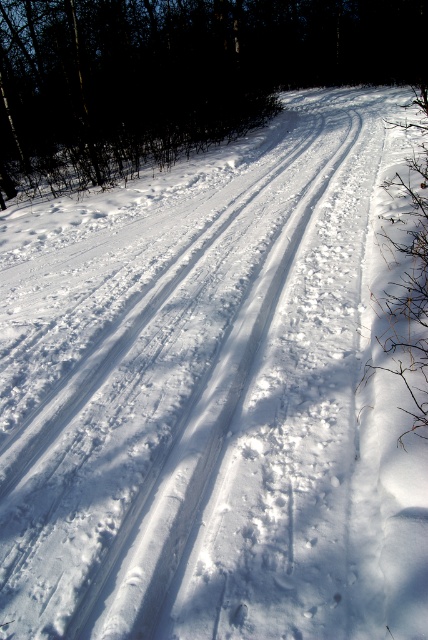
Question: Is brown wood tree at upper left positioned behind brown textured branch at right?

Choices:
 (A) no
 (B) yes

Answer: (B)

Question: Is brown wood tree at upper left to the left of brown textured branch at right from the viewer's perspective?

Choices:
 (A) yes
 (B) no

Answer: (A)

Question: Is brown wood tree at upper left to the left of brown textured branch at right from the viewer's perspective?

Choices:
 (A) no
 (B) yes

Answer: (B)

Question: Which object is farther from the camera taking this photo?

Choices:
 (A) brown textured branch at right
 (B) brown wood tree at upper left

Answer: (B)